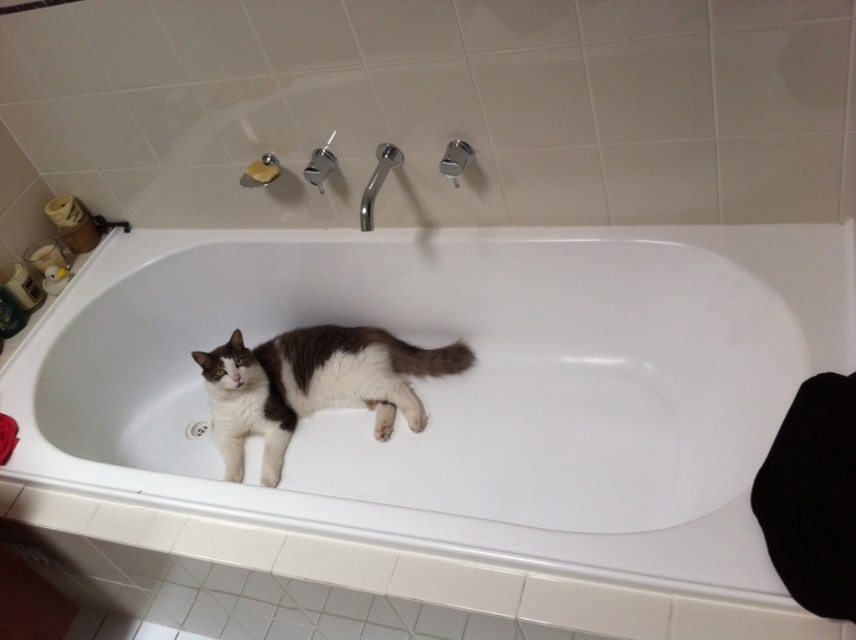
Consider the image. You are a person standing in the bathroom looking at the white glossy bathtub at center and the white fur cat at center. Which object is positioned lower in the image?

The white glossy bathtub at center is located below the white fur cat at center, so the bathtub is positioned lower.

You are a visitor in this bathroom and want to take a photo of the white glossy bathtub at center and the white fur cat at center. Since you want to include both in the frame, which object should you focus on to ensure both are fully visible?

You should focus on the white glossy bathtub at center because it is larger than the white fur cat at center, allowing both to fit within the frame when centered on the bathtub.

You are a cleaning robot with a width of 12 inches. You need to clean the bathroom and move around the white glossy bathtub at center and the white fur cat at center. Can you fit between them without touching either?

The distance between the white glossy bathtub at center and the white fur cat at center is 8.50 inches. Since the robot is 12 inches wide, it cannot fit through the space between them without touching either object.